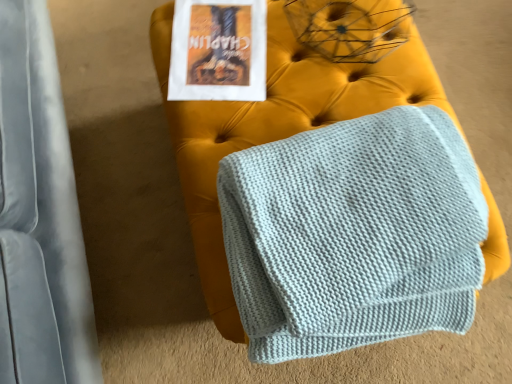
Where is `light blue knitted blanket at center`? The width and height of the screenshot is (512, 384). light blue knitted blanket at center is located at coordinates (315, 196).

The image size is (512, 384). Describe the element at coordinates (315, 196) in the screenshot. I see `light blue knitted blanket at center` at that location.

At what (x,y) coordinates should I click in order to perform the action: click on light blue knitted blanket at center. Please return your answer as a coordinate pair (x, y). Image resolution: width=512 pixels, height=384 pixels. Looking at the image, I should click on (315, 196).